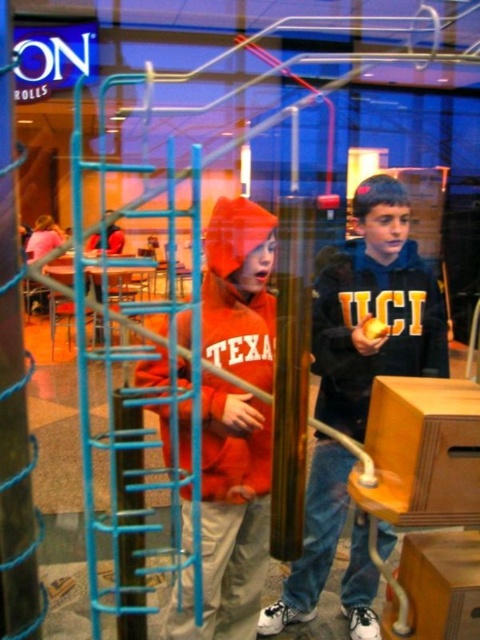
Question: Which point appears farthest from the camera in this image?

Choices:
 (A) (0, 147)
 (B) (236, 332)
 (C) (397, 378)
 (D) (304, 572)

Answer: (D)

Question: Among these objects, which one is farthest from the camera?

Choices:
 (A) wooden at center
 (B) spiral blue plastic at center
 (C) matte black hoodie at center

Answer: (C)

Question: Which of these objects is positioned closest to the orange fleece jacket at center?

Choices:
 (A) spiral blue plastic at center
 (B) matte black hoodie at center

Answer: (B)

Question: From the image, what is the correct spatial relationship of orange fleece jacket at center in relation to wooden at center?

Choices:
 (A) above
 (B) below

Answer: (A)

Question: In this image, where is matte black hoodie at center located relative to spiral blue plastic at center?

Choices:
 (A) right
 (B) left

Answer: (A)

Question: Can you confirm if matte black hoodie at center is positioned below wooden at center?

Choices:
 (A) yes
 (B) no

Answer: (A)